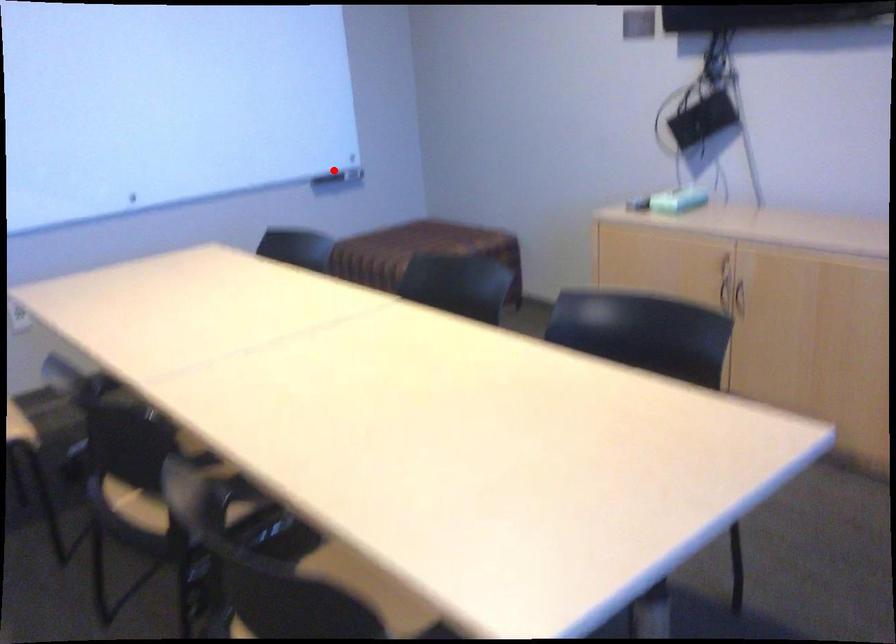
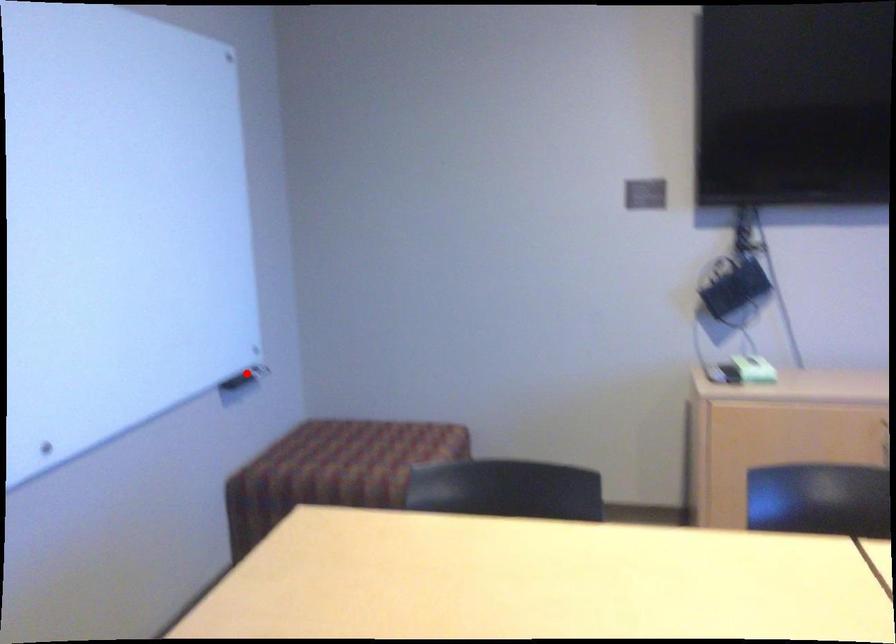
I am providing you with two images of the same scene from different viewpoints. A red point is marked on the first image and another point is marked on the second image. Do the highlighted points in image1 and image2 indicate the same real-world spot?

Yes